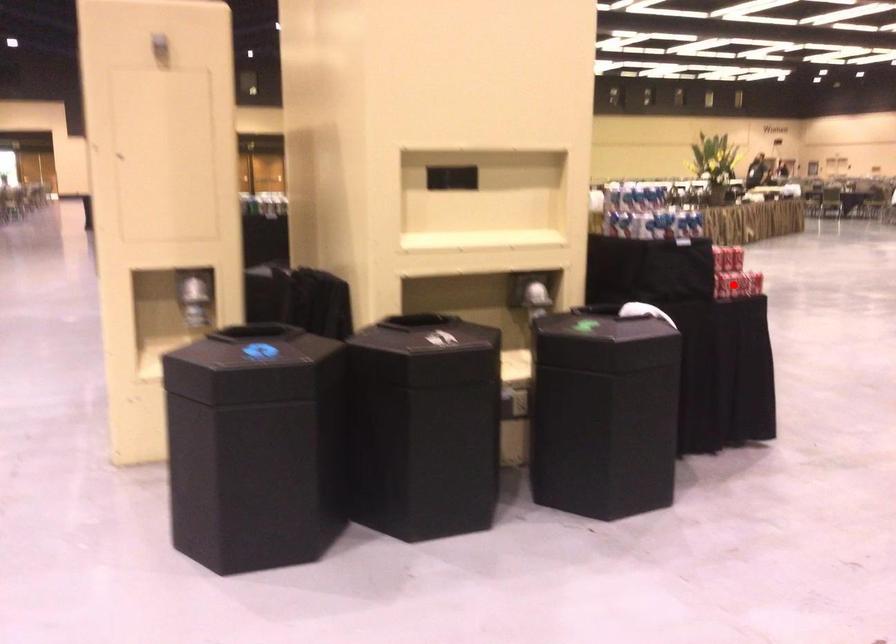
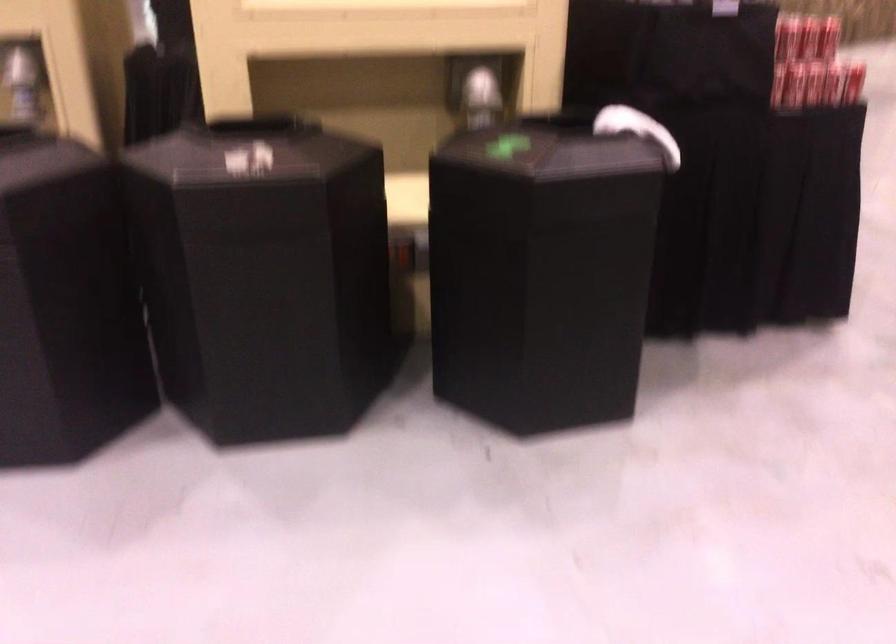
Question: I am providing you with two images of the same scene from different viewpoints. A red point is shown in image1. For the corresponding object point in image2, is it positioned nearer or farther from the camera?

Choices:
 (A) Nearer
 (B) Farther

Answer: (A)